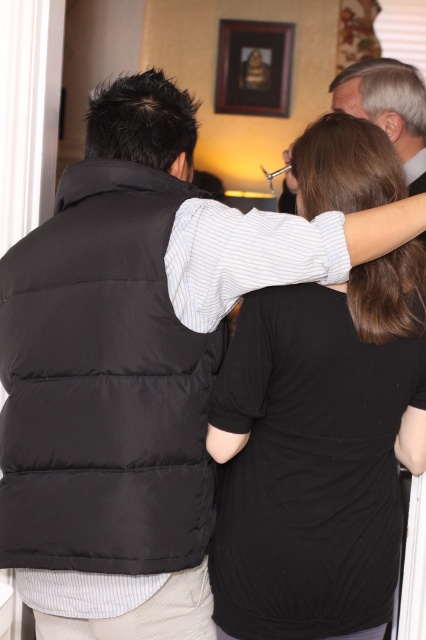
You are standing in the room and want to place a small plant between the two points, point (313,502) and point (114,516). Which point should the plant be closer to in order to be placed in the foreground?

The plant should be closer to point (114,516) because it is closer to the viewer compared to point (313,502) which is further away.

You are standing in a room with three people. You notice a point at coordinate (316, 451). According to the image, what object is located at that point?

The point at coordinate (316, 451) indicates the black matte shirt at upper center.

You are standing in a room with three people. You need to place a small plant exactly at the point labeled as point (x=85, y=248). If the plant is 1 foot tall, will it be visible to someone standing 5 feet away from that point?

The distance of point (x=85, y=248) from camera is 4.72 feet. Since the plant is 1 foot tall and the person is standing 5 feet away from the point, they are slightly farther than the plant is from the camera. The plant may be partially visible depending on angles, but visibility cannot be guaranteed with the given information.